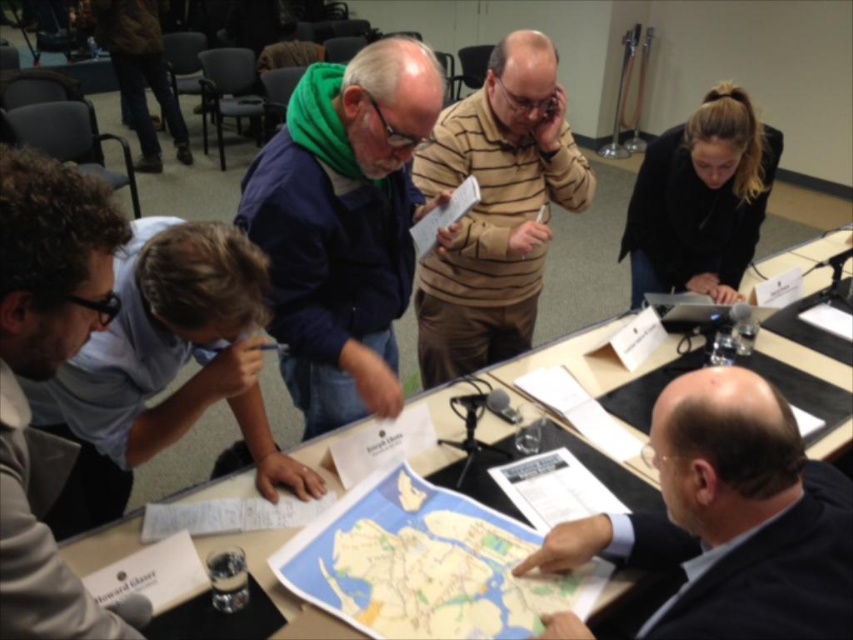
Question: Which of the following is the closest to the observer?

Choices:
 (A) (131, 472)
 (B) (422, 61)

Answer: (B)

Question: Does dark suit jacket at lower right come in front of blue shirt at lower left?

Choices:
 (A) no
 (B) yes

Answer: (B)

Question: Which of the following is the closest to the observer?

Choices:
 (A) (396, 316)
 (B) (563, 536)

Answer: (B)

Question: Can you confirm if dark suit jacket at lower right is positioned to the right of black matte jacket at upper right?

Choices:
 (A) no
 (B) yes

Answer: (A)

Question: Is green fleece at center below blue paper map at center?

Choices:
 (A) no
 (B) yes

Answer: (A)

Question: Estimate the real-world distances between objects in this image. Which object is farther from the brown leather jacket at lower left?

Choices:
 (A) green fleece at center
 (B) black plastic table at center

Answer: (A)